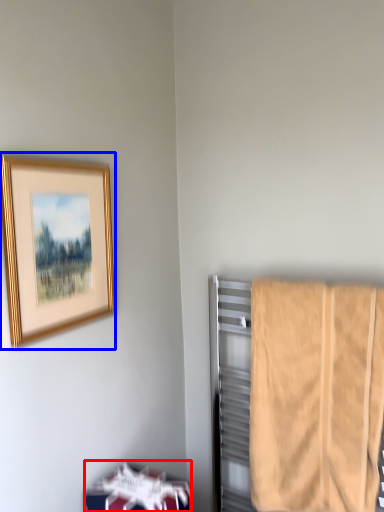
Question: Which point is further to the camera, furniture (highlighted by a red box) or picture frame (highlighted by a blue box)?

Choices:
 (A) furniture
 (B) picture frame

Answer: (A)